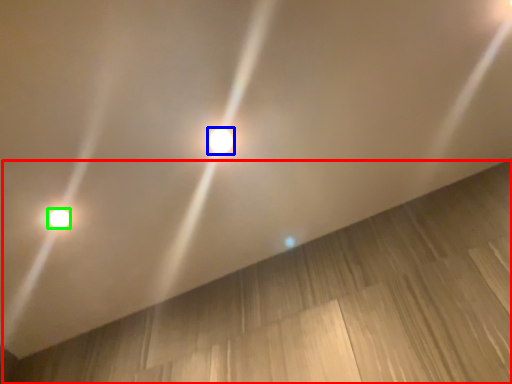
Question: Considering the real-world distances, which object is closest to plywood (highlighted by a red box)? lamp (highlighted by a blue box) or lamp (highlighted by a green box).

Choices:
 (A) lamp
 (B) lamp

Answer: (A)